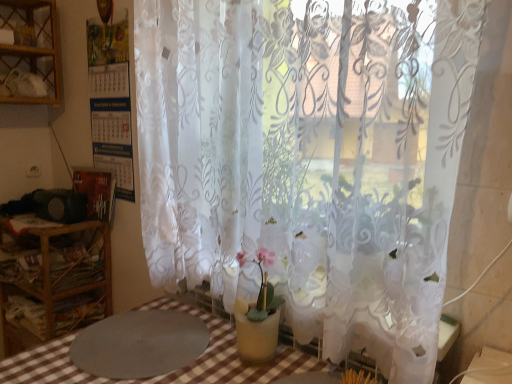
Describe the element at coordinates (308, 160) in the screenshot. I see `transparent floral-patterned curtain at center` at that location.

Image resolution: width=512 pixels, height=384 pixels. What do you see at coordinates (31, 49) in the screenshot?
I see `wooden shelf at upper left` at bounding box center [31, 49].

What is the approximate width of wooden shelf at upper left?

wooden shelf at upper left is 11.03 inches wide.

I want to click on transparent floral-patterned curtain at center, so click(x=308, y=160).

Who is more distant, wooden shelf at upper left or wooden shelf at left?

wooden shelf at upper left is behind.

Which point is more distant from viewer, (40, 53) or (27, 346)?

The point (40, 53) is farther.

Is wooden shelf at upper left thinner than wooden shelf at left?

Correct, the width of wooden shelf at upper left is less than that of wooden shelf at left.

Would you say wooden shelf at left is part of wooden shelf at upper left's contents?

No, wooden shelf at left is not inside wooden shelf at upper left.

Is wooden shelf at left directly adjacent to wooden shelf at upper left?

There is a gap between wooden shelf at left and wooden shelf at upper left.

Would you say wooden shelf at left is inside or outside wooden shelf at upper left?

wooden shelf at left is outside wooden shelf at upper left.

Is wooden shelf at left to the right of wooden shelf at upper left from the viewer's perspective?

Yes.

Which is behind, point (18, 264) or point (159, 78)?

The point (18, 264) is more distant.

Measure the distance from wooden shelf at left to transparent floral-patterned curtain at center.

They are 3.32 feet apart.

Is wooden shelf at left thinner than transparent floral-patterned curtain at center?

No.

From the image's perspective, which is above, wooden shelf at left or transparent floral-patterned curtain at center?

transparent floral-patterned curtain at center is shown above in the image.

From a real-world perspective, is wooden shelf at left positioned under gray textured mat at lower left based on gravity?

Yes.

Is wooden shelf at left spatially inside gray textured mat at lower left, or outside of it?

wooden shelf at left is not inside gray textured mat at lower left, it's outside.

Can you tell me how much wooden shelf at left and gray textured mat at lower left differ in facing direction?

The facing directions of wooden shelf at left and gray textured mat at lower left are 2.09 degrees apart.

Is point (89, 246) closer or farther from the camera than point (179, 339)?

Point (89, 246) appears to be farther away from the viewer than point (179, 339).

Between transparent floral-patterned curtain at center and wooden shelf at left, which one appears on the left side from the viewer's perspective?

wooden shelf at left.

Can you confirm if transparent floral-patterned curtain at center is thinner than wooden shelf at left?

Indeed, transparent floral-patterned curtain at center has a lesser width compared to wooden shelf at left.

Considering the sizes of objects transparent floral-patterned curtain at center and wooden shelf at left in the image provided, who is taller, transparent floral-patterned curtain at center or wooden shelf at left?

transparent floral-patterned curtain at center is taller.

Find the location of a particular element. curtain that is above the wooden shelf at left (from a real-world perspective) is located at coordinates click(308, 160).

In terms of size, does wooden shelf at upper left appear bigger or smaller than gray textured mat at lower left?

Clearly, wooden shelf at upper left is larger in size than gray textured mat at lower left.

The height and width of the screenshot is (384, 512). In order to click on shelf on the left side of gray textured mat at lower left in this screenshot , I will do `click(31, 49)`.

Considering the sizes of objects wooden shelf at upper left and gray textured mat at lower left in the image provided, who is shorter, wooden shelf at upper left or gray textured mat at lower left?

Standing shorter between the two is gray textured mat at lower left.

Is wooden shelf at upper left turned away from gray textured mat at lower left?

No.

Based on the photo, is wooden shelf at upper left positioned beyond the bounds of transparent floral-patterned curtain at center?

That's correct, wooden shelf at upper left is outside of transparent floral-patterned curtain at center.

Is wooden shelf at upper left positioned with its back to transparent floral-patterned curtain at center?

wooden shelf at upper left does not have its back to transparent floral-patterned curtain at center.

Based on the photo, does wooden shelf at upper left have a smaller size compared to transparent floral-patterned curtain at center?

Yes, wooden shelf at upper left is smaller than transparent floral-patterned curtain at center.

What's the angular difference between wooden shelf at upper left and transparent floral-patterned curtain at center's facing directions?

The angle between the facing direction of wooden shelf at upper left and the facing direction of transparent floral-patterned curtain at center is 90.8 degrees.

The height and width of the screenshot is (384, 512). In order to click on furniture directly beneath the wooden shelf at upper left (from a real-world perspective) in this screenshot , I will do `click(53, 277)`.

I want to click on shelf behind the wooden shelf at left, so click(x=31, y=49).

Based on the photo, which object lies nearer to the anchor point wooden shelf at left, gray textured mat at lower left or wooden shelf at upper left?

gray textured mat at lower left is positioned closer to the anchor wooden shelf at left.

Consider the image. From the image, which object appears to be farther from gray textured mat at lower left, transparent floral-patterned curtain at center or wooden shelf at left?

wooden shelf at left is further to gray textured mat at lower left.

Based on their spatial positions, is wooden shelf at left or gray textured mat at lower left closer to wooden shelf at upper left?

wooden shelf at left is closer to wooden shelf at upper left.

Which object lies further to the anchor point wooden shelf at upper left, transparent floral-patterned curtain at center or gray textured mat at lower left?

gray textured mat at lower left lies further to wooden shelf at upper left than the other object.

Looking at the image, which one is located closer to gray textured mat at lower left, wooden shelf at left or transparent floral-patterned curtain at center?

Among the two, transparent floral-patterned curtain at center is located nearer to gray textured mat at lower left.

Looking at the image, which one is located closer to wooden shelf at left, transparent floral-patterned curtain at center or gray textured mat at lower left?

→ Among the two, gray textured mat at lower left is located nearer to wooden shelf at left.

From the image, which object appears to be farther from wooden shelf at upper left, transparent floral-patterned curtain at center or wooden shelf at left?

transparent floral-patterned curtain at center.

From the picture: Estimate the real-world distances between objects in this image. Which object is closer to wooden shelf at upper left, gray textured mat at lower left or transparent floral-patterned curtain at center?

transparent floral-patterned curtain at center is positioned closer to the anchor wooden shelf at upper left.

Where is `round table between wooden shelf at upper left and transparent floral-patterned curtain at center`? The height and width of the screenshot is (384, 512). round table between wooden shelf at upper left and transparent floral-patterned curtain at center is located at coordinates (139, 344).

Find the location of a particular element. This screenshot has height=384, width=512. furniture between transparent floral-patterned curtain at center and wooden shelf at upper left in the front-back direction is located at coordinates (53, 277).

Where is `round table between wooden shelf at upper left and wooden shelf at left from top to bottom`? The height and width of the screenshot is (384, 512). round table between wooden shelf at upper left and wooden shelf at left from top to bottom is located at coordinates (139, 344).

Locate an element on the screen. round table located between transparent floral-patterned curtain at center and wooden shelf at left in the depth direction is located at coordinates (139, 344).